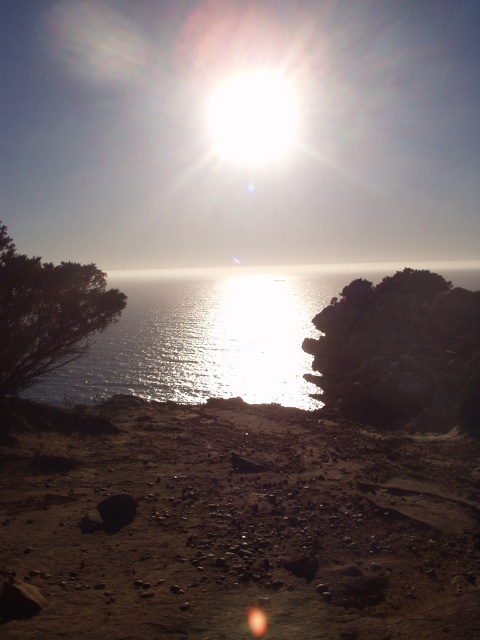
Question: Which object is the farthest from the dark rock at right?

Choices:
 (A) silvery reflective water at center
 (B) dull brown sand at lower center

Answer: (A)

Question: Does dull brown sand at lower center have a lesser width compared to silvery reflective water at center?

Choices:
 (A) yes
 (B) no

Answer: (A)

Question: Can you confirm if dull brown sand at lower center is smaller than silvery reflective water at center?

Choices:
 (A) no
 (B) yes

Answer: (B)

Question: Which object appears closest to the camera in this image?

Choices:
 (A) dull brown sand at lower center
 (B) silvery reflective water at center
 (C) dark rock at right

Answer: (A)

Question: Is dull brown sand at lower center positioned before dark rock at right?

Choices:
 (A) no
 (B) yes

Answer: (B)

Question: Which point appears farthest from the camera in this image?

Choices:
 (A) (284, 328)
 (B) (336, 372)
 (C) (466, 572)

Answer: (A)